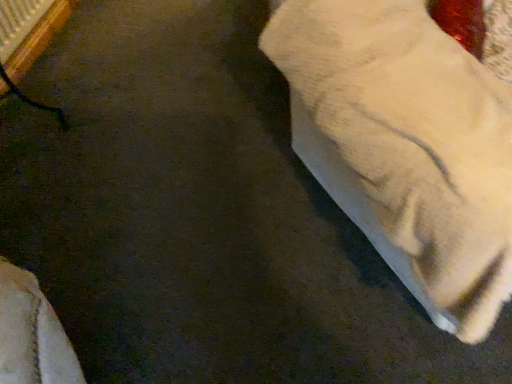
The image size is (512, 384). What do you see at coordinates (406, 146) in the screenshot? I see `white cotton towel at lower right` at bounding box center [406, 146].

The height and width of the screenshot is (384, 512). In order to click on white cotton towel at lower right in this screenshot , I will do `click(406, 146)`.

The height and width of the screenshot is (384, 512). Identify the location of white cotton towel at lower right. (406, 146).